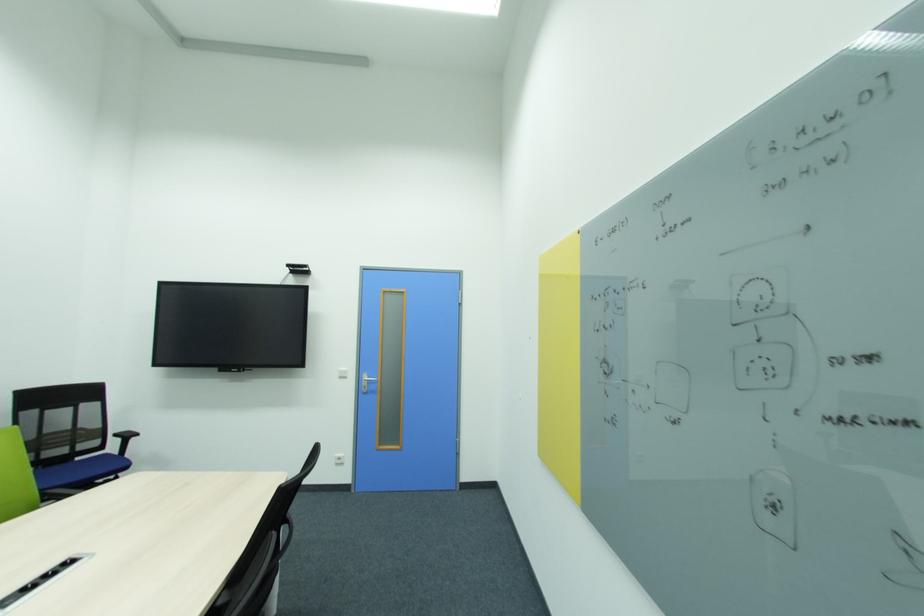
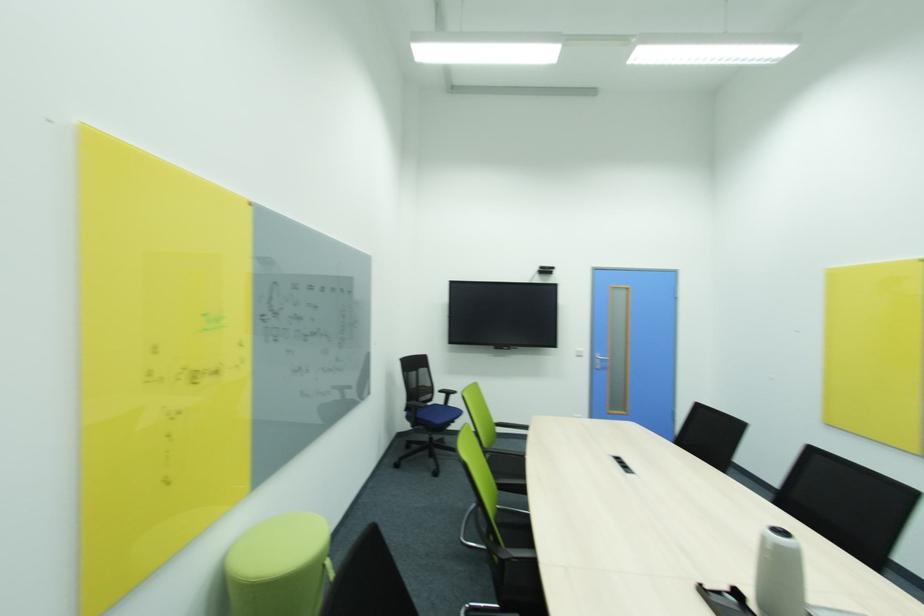
Where in the second image is the point corresponding to point 93,408 from the first image?

(428, 371)